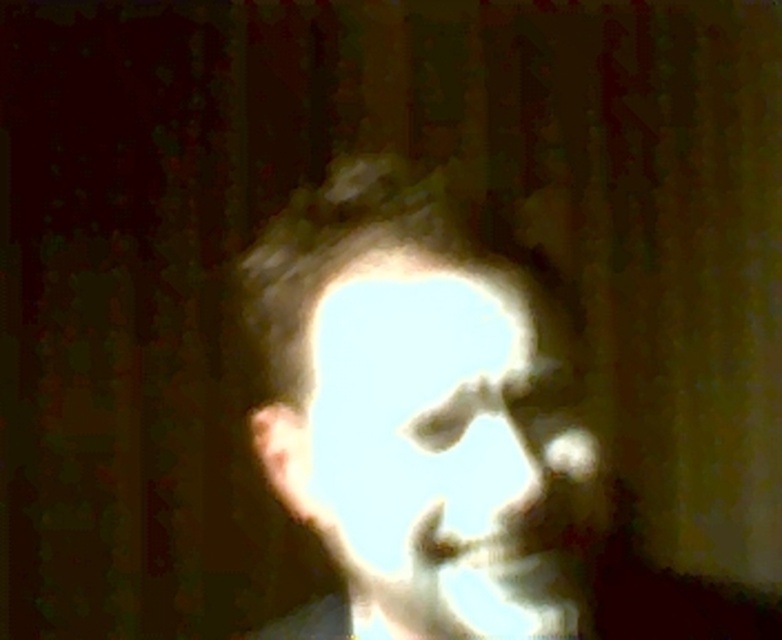
Does light gray matte face at center appear on the right side of translucent white face at center?

Correct, you'll find light gray matte face at center to the right of translucent white face at center.

Is the position of light gray matte face at center more distant than that of translucent white face at center?

Yes, it is.

Is point (246, 472) behind point (424, 467)?

Yes.

The width and height of the screenshot is (782, 640). What are the coordinates of `light gray matte face at center` in the screenshot? It's located at [x=504, y=396].